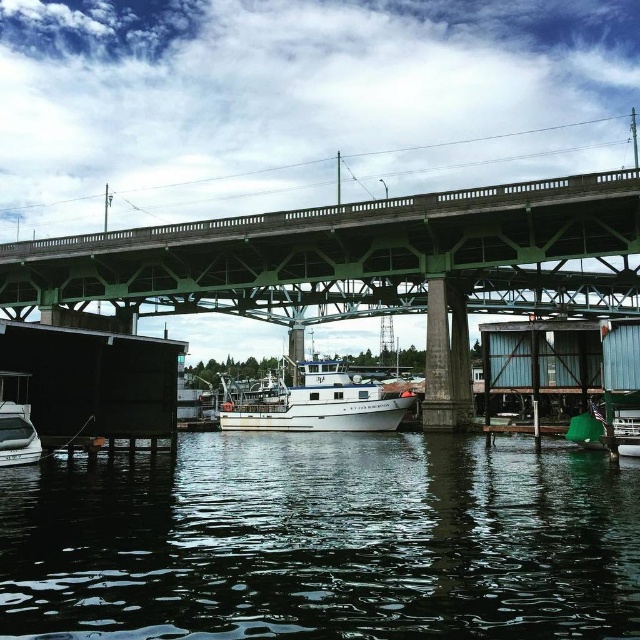
You are a photographer planning to capture the waterfront scene. You want to ensure both the transparent water at lower center and the green concrete bridge at center are visible in your shot. Which object will occupy more of the frame?

The green concrete bridge at center occupies more space in the frame than the transparent water at lower center, as the bridge takes up more area according to the description.

You are standing on the dock and want to board the white matte boat at center. Which direction should you move to avoid the green concrete bridge at center blocking your path?

To board the white matte boat at center without the green concrete bridge at center blocking your path, move towards the left side of the boat since the bridge is located above it.

You are a photographer planning to take a photo of the white matte boat at center and the transparent water at lower center. Based on their positions, which object should you focus on first if you want to capture both in a single shot without moving the camera?

The white matte boat at center should be focused on first because the transparent water at lower center is shorter than it, meaning the boat is closer to the camera and would require focusing on the closer object first to ensure both are in focus.